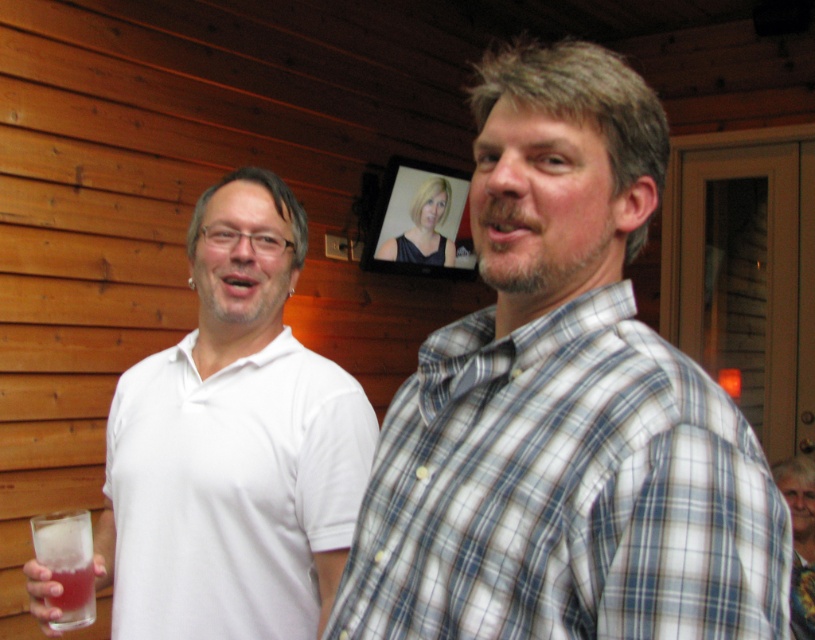
You are at a social gathering and see a point marked at coordinates (x=564, y=492). Which object from the image does this point belong to?

The point at (x=564, y=492) is on the bluegray plaid shirt at right.